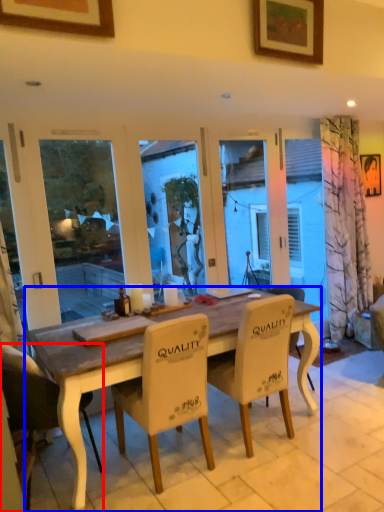
Question: Which point is closer to the camera, chair (highlighted by a red box) or desk (highlighted by a blue box)?

Choices:
 (A) chair
 (B) desk

Answer: (B)